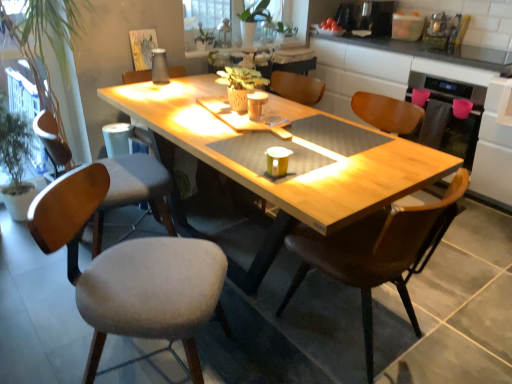
Question: In the image, is light gray fabric chair at left, the second chair from the left, positioned in front of or behind yellow matte coffee cup at center, the second coffee cup from the back?

Choices:
 (A) behind
 (B) front

Answer: (B)

Question: From their relative heights in the image, would you say light gray fabric chair at left, the second chair viewed from the right, is taller or shorter than yellow matte coffee cup at center, which ranks as the 2th coffee cup in top-to-bottom order?

Choices:
 (A) tall
 (B) short

Answer: (A)

Question: Estimate the real-world distances between objects in this image. Which object is farther from the green matte plant at upper center, placed as the first houseplant when sorted from right to left?

Choices:
 (A) wooden counter at upper right
 (B) matte brown coffee cup at center, the 2th coffee cup viewed from the front
 (C) yellow matte coffee cup at center, which is the first coffee cup in bottom-to-top order
 (D) gray fabric chair at left, the 3th chair when ordered from right to left
 (E) green leafy plant at left, marked as the 1th houseplant in a front-to-back arrangement

Answer: (C)

Question: Which of these objects is positioned closest to the green leafy plant at left, the 1th houseplant from the bottom?

Choices:
 (A) light gray fabric chair at left, the second chair viewed from the right
 (B) white sheer curtain at upper center
 (C) green matte plant at upper center, the 2th houseplant viewed from the front
 (D) brown leather chair at center, placed as the third chair when sorted from left to right
 (E) wooden counter at upper right

Answer: (A)